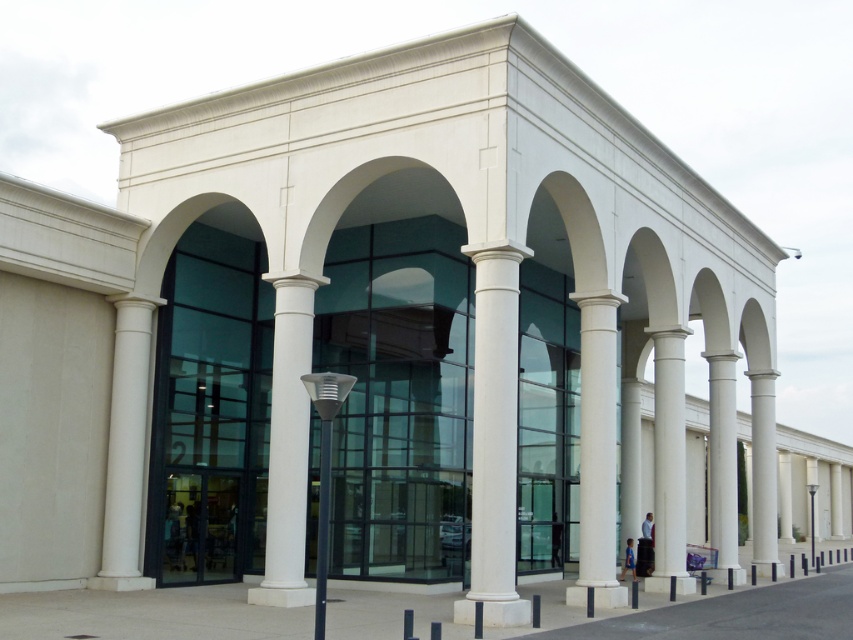
Which of these two, slate gray concrete pavement at center or white smooth column at center, stands taller?

Standing taller between the two is slate gray concrete pavement at center.

Is slate gray concrete pavement at center taller than white smooth column at center?

Yes.

Is point (639, 628) positioned behind point (285, 500)?

No, (639, 628) is in front of (285, 500).

Locate an element on the screen. The image size is (853, 640). slate gray concrete pavement at center is located at coordinates (718, 612).

Which of these two, slate gray concrete pavement at center or white smooth column at left, stands taller?

Standing taller between the two is white smooth column at left.

The width and height of the screenshot is (853, 640). What are the coordinates of `slate gray concrete pavement at center` in the screenshot? It's located at (718, 612).

Who is more forward, (503, 561) or (115, 460)?

Positioned in front is point (503, 561).

Does white marble column at center have a lesser height compared to white smooth column at left?

Yes.

Between point (490, 435) and point (131, 346), which one is positioned in front?

Point (490, 435)

Where is `white marble column at center`? white marble column at center is located at coordinates (494, 438).